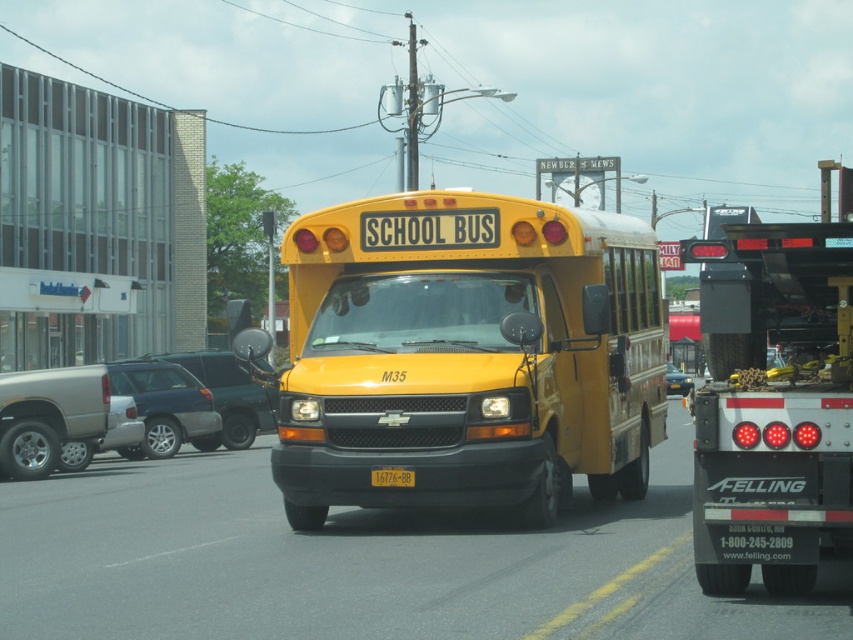
Question: Which of these objects is positioned farthest from the satin black sedan at center?

Choices:
 (A) black rubber tow truck at right
 (B) metallic blue sedan at center

Answer: (A)

Question: Does black rubber tow truck at right have a greater width compared to satin black sedan at center?

Choices:
 (A) no
 (B) yes

Answer: (B)

Question: Can you confirm if yellow matte school bus at center is thinner than metallic blue sedan at center?

Choices:
 (A) no
 (B) yes

Answer: (B)

Question: Which point is closer to the camera taking this photo?

Choices:
 (A) click(x=669, y=387)
 (B) click(x=833, y=516)
 (C) click(x=193, y=403)

Answer: (B)

Question: Does metallic gray suv at center-left have a lesser width compared to yellow matte license plate at center?

Choices:
 (A) no
 (B) yes

Answer: (A)

Question: Which point is closer to the camera taking this photo?

Choices:
 (A) (596, 372)
 (B) (198, 378)
 (C) (387, 484)

Answer: (C)